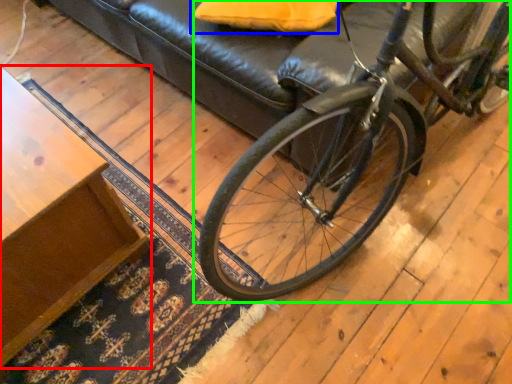
Question: Estimate the real-world distances between objects in this image. Which object is closer to table (highlighted by a red box), pillow (highlighted by a blue box) or bicycle (highlighted by a green box)?

Choices:
 (A) pillow
 (B) bicycle

Answer: (B)